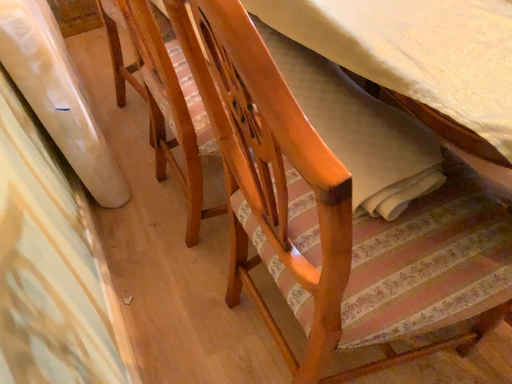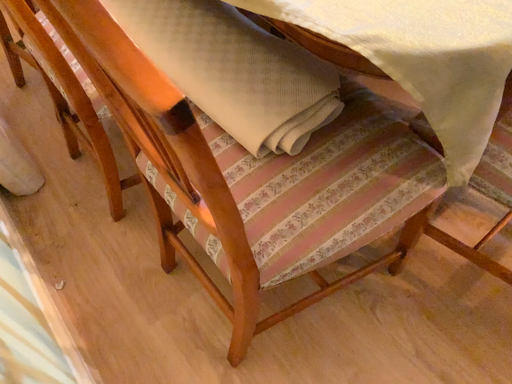
Question: How did the camera likely rotate when shooting the video?

Choices:
 (A) rotated right
 (B) rotated left

Answer: (A)